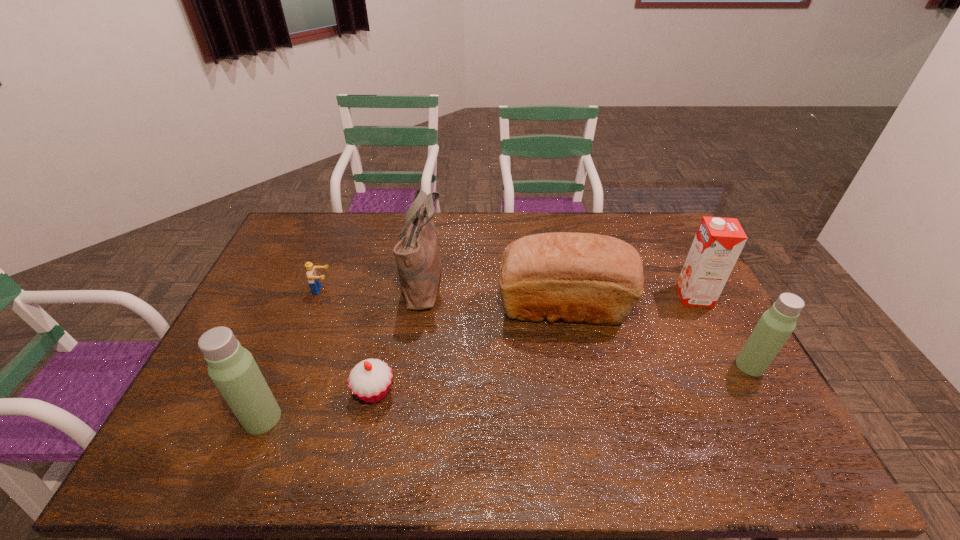
I want to click on the left thermos bottle, so click(x=232, y=368).

You are a GUI agent. You are given a task and a screenshot of the screen. Output one action in this format:
    pyautogui.click(x=<x>, y=<y>)
    Task: Click on the taller thermos bottle
    This screenshot has width=960, height=540.
    Given the screenshot: What is the action you would take?
    pyautogui.click(x=232, y=368)

Locate an element on the screen. the shorter thermos bottle is located at coordinates (775, 326).

Identify the location of the farther thermos bottle. The height and width of the screenshot is (540, 960). (775, 326).

At what (x,y) coordinates should I click in order to perform the action: click on shoulder bag. Please return your answer as a coordinate pair (x, y). The image size is (960, 540). Looking at the image, I should click on (417, 258).

You are a GUI agent. You are given a task and a screenshot of the screen. Output one action in this format:
    pyautogui.click(x=<x>, y=<y>)
    Task: Click on the Lego
    
    Given the screenshot: What is the action you would take?
    pyautogui.click(x=313, y=279)

Find the location of a particular element. This screenshot has width=960, height=540. cupcake is located at coordinates (370, 380).

This screenshot has width=960, height=540. What are the coordinates of `the fifth object from left to right` in the screenshot? It's located at (580, 277).

Identify the location of carton. This screenshot has height=540, width=960. (719, 241).

Find the location of `vacant space located on the back of the taller thermos bottle`. vacant space located on the back of the taller thermos bottle is located at coordinates (309, 301).